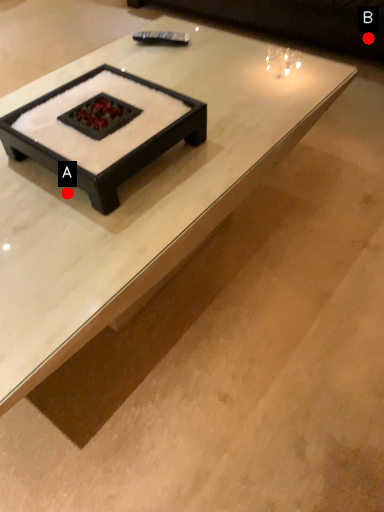
Question: Two points are circled on the image, labeled by A and B beside each circle. Which point is further to the camera?

Choices:
 (A) A is further
 (B) B is further

Answer: (B)